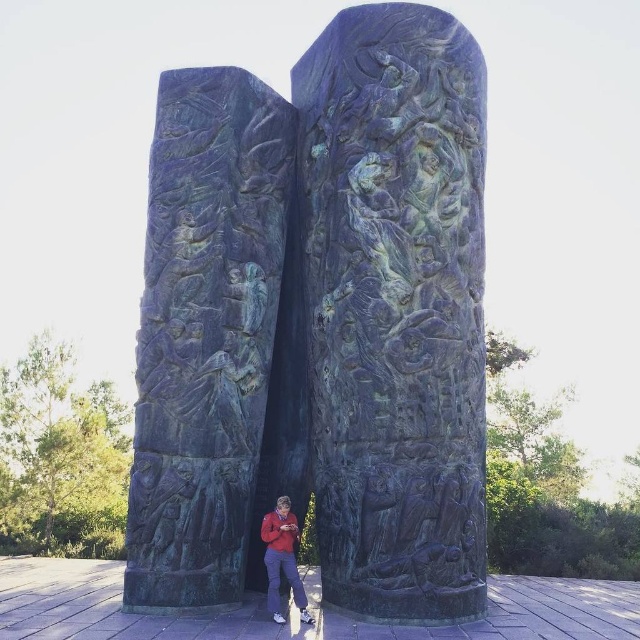
Question: In this image, where is green patinated stone relief at center located relative to matte red jacket at lower center?

Choices:
 (A) below
 (B) above

Answer: (B)

Question: Which object is closer to the camera taking this photo?

Choices:
 (A) matte red jacket at lower center
 (B) green patinated stone relief at center
 (C) green patina stone carving at center

Answer: (A)

Question: From the image, what is the correct spatial relationship of green patina stone carving at center in relation to green patinated stone relief at center?

Choices:
 (A) above
 (B) below

Answer: (B)

Question: Which of these objects is positioned farthest from the green patinated stone relief at center?

Choices:
 (A) green patina stone carving at center
 (B) matte red jacket at lower center

Answer: (A)

Question: Where is green patina stone carving at center located in relation to matte red jacket at lower center in the image?

Choices:
 (A) below
 (B) above

Answer: (B)

Question: Which object is positioned closest to the green patinated stone relief at center?

Choices:
 (A) matte red jacket at lower center
 (B) green patina stone carving at center

Answer: (A)